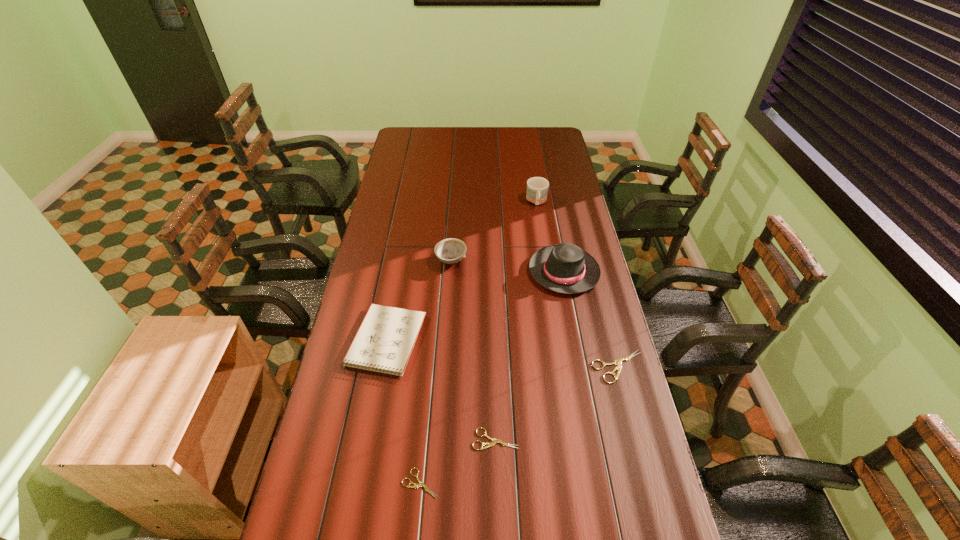
You are a GUI agent. You are given a task and a screenshot of the screen. Output one action in this format:
    pyautogui.click(x=<x>, y=<y>)
    Task: Click on the free space located on the left of the shortest shears
    
    Given the screenshot: What is the action you would take?
    pyautogui.click(x=324, y=483)

What are the coordinates of `vacant space located 0.060m on the left of the second farthest shears` in the screenshot? It's located at (451, 439).

Locate an element on the screen. The height and width of the screenshot is (540, 960). free space located on the left of the fifth tallest object is located at coordinates (481, 367).

Locate an element on the screen. This screenshot has width=960, height=540. vacant space situated on the side with the handle of the farthest object is located at coordinates (547, 268).

You are a GUI agent. You are given a task and a screenshot of the screen. Output one action in this format:
    pyautogui.click(x=<x>, y=<y>)
    Task: Click on the vacant space located on the right of the bowl
    This screenshot has height=540, width=960.
    Given the screenshot: What is the action you would take?
    pyautogui.click(x=568, y=260)

At what (x,y) coordinates should I click in order to perform the action: click on vacant space situated 0.300m on the right of the notepad. Please return your answer as a coordinate pair (x, y). Looking at the image, I should click on (515, 342).

You are a GUI agent. You are given a task and a screenshot of the screen. Output one action in this format:
    pyautogui.click(x=<x>, y=<y>)
    Task: Click on the vacant point located on the back of the dress hat
    The height and width of the screenshot is (540, 960).
    Given the screenshot: What is the action you would take?
    pyautogui.click(x=550, y=200)

I want to click on object that is at the near edge, so click(x=421, y=484).

The width and height of the screenshot is (960, 540). Identify the location of object present at the left edge. (384, 342).

I want to click on shears positioned at the right edge, so click(x=618, y=361).